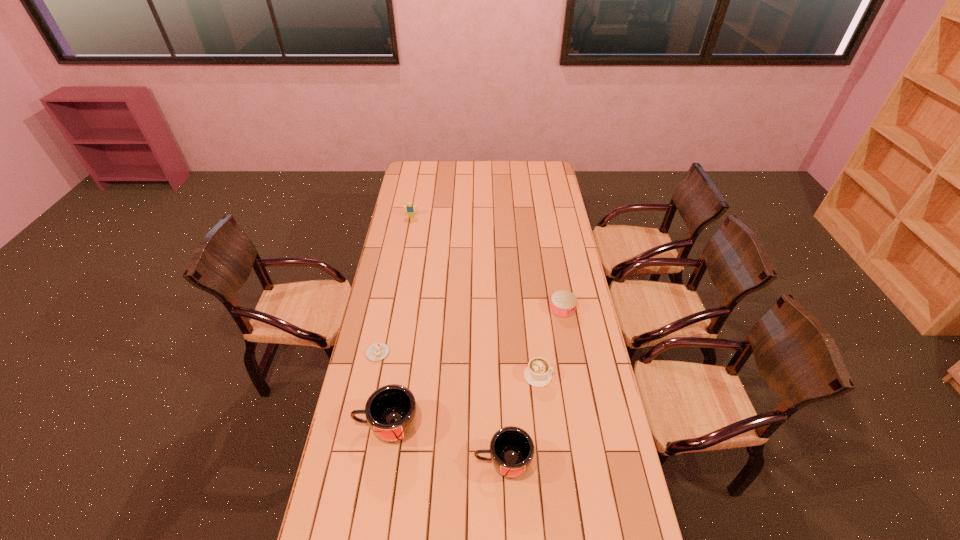
At what (x,y) coordinates should I click in order to perform the action: click on blank region between the cappuccino and the cupcake. Please return your answer as a coordinate pair (x, y). Looking at the image, I should click on (458, 364).

Identify the location of free space between the cappuccino and the rightmost object. (550, 342).

I want to click on vacant area that lies between the shorter mug and the taller mug, so click(x=445, y=444).

Where is `free area in between the second farthest object and the cappuccino`? The image size is (960, 540). free area in between the second farthest object and the cappuccino is located at coordinates (550, 342).

The height and width of the screenshot is (540, 960). In order to click on object identified as the second closest to the second farthest object in this screenshot , I will do `click(511, 450)`.

Find the location of a particular element. object that is the fourth nearest to the cappuccino is located at coordinates (377, 351).